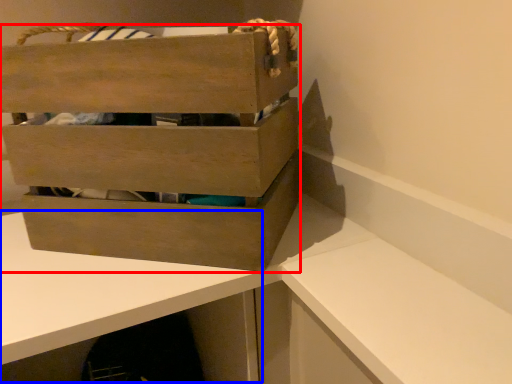
Question: Which of the following is the farthest to the observer, box (highlighted by a red box) or table (highlighted by a blue box)?

Choices:
 (A) box
 (B) table

Answer: (A)